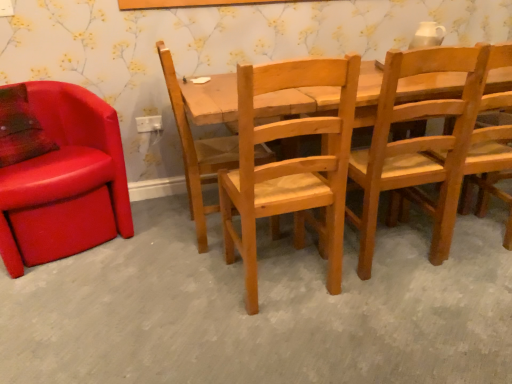
At what (x,y) coordinates should I click in order to perform the action: click on vacant area that lies to the right of natural wood chair at center, placed as the third chair when sorted from left to right. Please return your answer as a coordinate pair (x, y). Looking at the image, I should click on (387, 297).